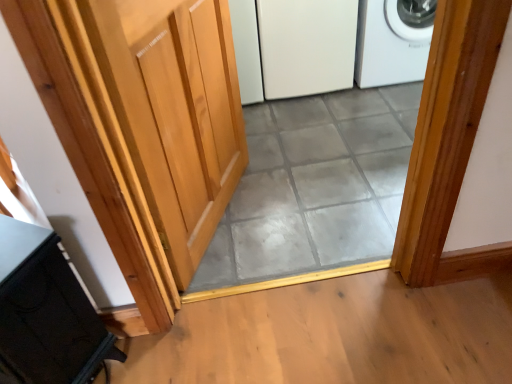
In order to click on free point above gray tile at center (from a real-world perspective) in this screenshot , I will do [x=322, y=157].